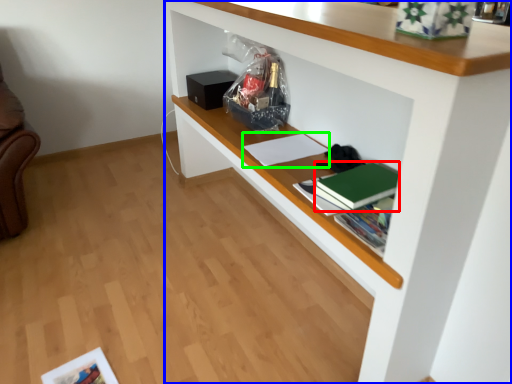
Question: Which is nearer to the paperback book (highlighted by a red box)? shelf (highlighted by a blue box) or book (highlighted by a green box).

Choices:
 (A) shelf
 (B) book

Answer: (A)